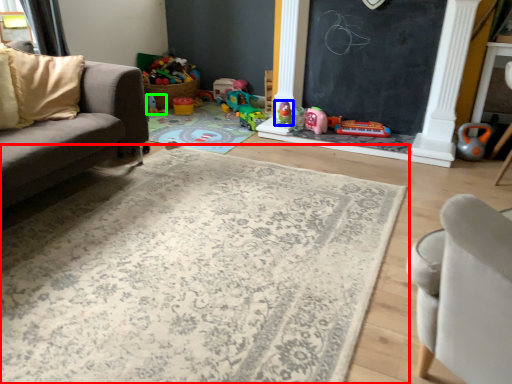
Question: Estimate the real-world distances between objects in this image. Which object is farther from mat (highlighted by a red box), toy (highlighted by a blue box) or toy (highlighted by a green box)?

Choices:
 (A) toy
 (B) toy

Answer: (B)